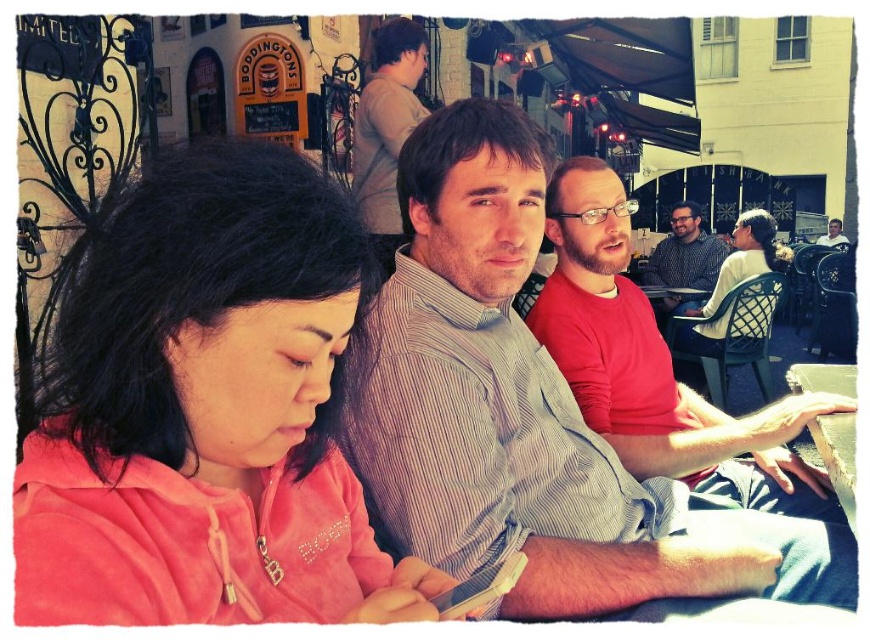
Who is shorter, pink fleece jacket at center or striped cotton shirt at center?

pink fleece jacket at center

Who is positioned more to the right, pink fleece jacket at center or striped cotton shirt at center?

From the viewer's perspective, striped cotton shirt at center appears more on the right side.

What do you see at coordinates (206, 412) in the screenshot? I see `pink fleece jacket at center` at bounding box center [206, 412].

At what (x,y) coordinates should I click in order to perform the action: click on pink fleece jacket at center. Please return your answer as a coordinate pair (x, y). Looking at the image, I should click on (206, 412).

Is striped cotton shirt at center to the left of smooth skin face at upper right from the viewer's perspective?

Yes, striped cotton shirt at center is to the left of smooth skin face at upper right.

In the scene shown: Can you confirm if striped cotton shirt at center is positioned below smooth skin face at upper right?

Correct, striped cotton shirt at center is located below smooth skin face at upper right.

Is point (718, 544) more distant than point (830, 237)?

No, it is in front of (830, 237).

Find the location of a particular element. striped cotton shirt at center is located at coordinates (529, 416).

Which of these two, striped cotton shirt at center or patterned shirt at center, stands shorter?

Standing shorter between the two is patterned shirt at center.

Based on the photo, who is more forward, (442,392) or (683,259)?

Point (442,392)

Is point (403, 532) positioned behind point (719, 253)?

No, (403, 532) is closer to viewer.

Where is `striped cotton shirt at center`? The height and width of the screenshot is (640, 870). striped cotton shirt at center is located at coordinates (529, 416).